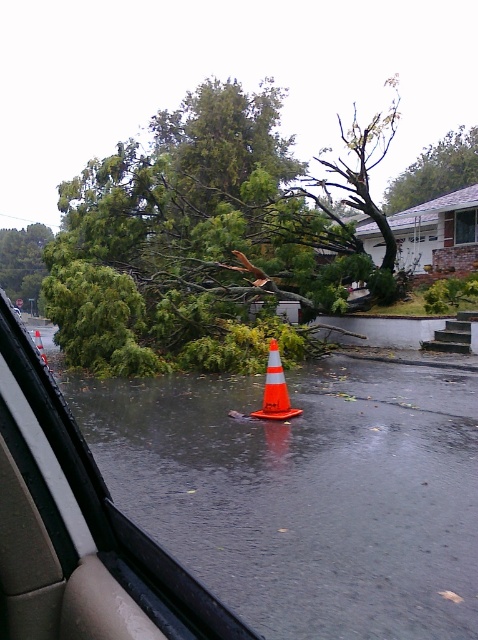
Does green leafy tree at center appear on the left side of green leafy tree at left?

Incorrect, green leafy tree at center is not on the left side of green leafy tree at left.

Who is lower down, green leafy tree at center or green leafy tree at left?

Positioned lower is green leafy tree at left.

Identify the location of green leafy tree at center. (207, 240).

The image size is (478, 640). What do you see at coordinates (304, 492) in the screenshot? I see `wet asphalt flood at lower center` at bounding box center [304, 492].

Is point (210, 448) closer to viewer compared to point (278, 376)?

Yes, it is.

The width and height of the screenshot is (478, 640). I want to click on wet asphalt flood at lower center, so click(304, 492).

Who is shorter, green leafy tree at center or green leafy tree at upper center?

green leafy tree at upper center

The width and height of the screenshot is (478, 640). I want to click on green leafy tree at center, so click(207, 240).

What do you see at coordinates (207, 240) in the screenshot? Image resolution: width=478 pixels, height=640 pixels. I see `green leafy tree at center` at bounding box center [207, 240].

At what (x,y) coordinates should I click in order to perform the action: click on green leafy tree at center. Please return your answer as a coordinate pair (x, y). This screenshot has height=640, width=478. Looking at the image, I should click on (207, 240).